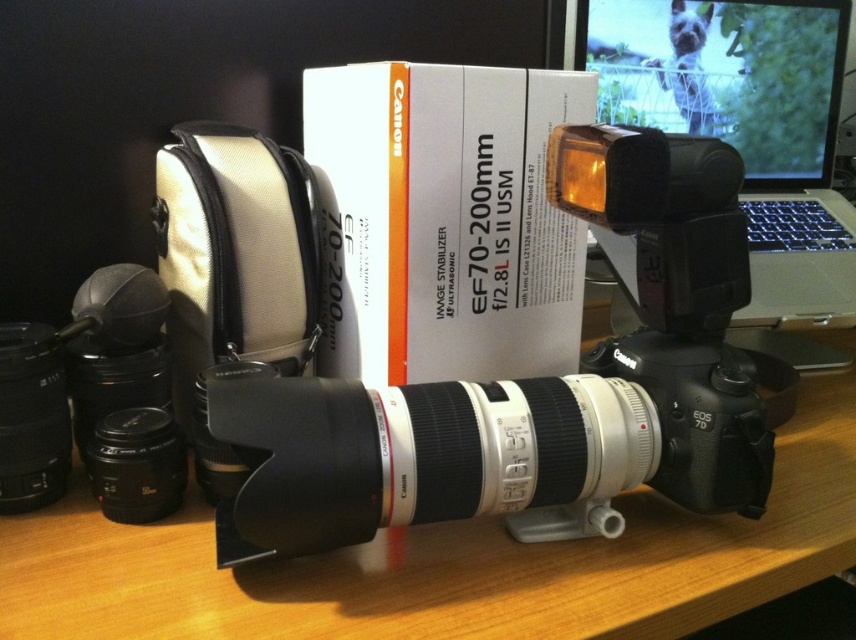
Is wooden table at center smaller than silver metallic laptop at upper right?

Actually, wooden table at center might be larger than silver metallic laptop at upper right.

Is wooden table at center below silver metallic laptop at upper right?

Correct, wooden table at center is located below silver metallic laptop at upper right.

Is point (394, 573) in front of point (764, 216)?

Yes, it is.

The image size is (856, 640). In order to click on wooden table at center in this screenshot , I will do `click(446, 563)`.

How distant is black plastic camera at center from silver metallic laptop at upper right?

33.86 centimeters

Does black plastic camera at center appear on the left side of silver metallic laptop at upper right?

Indeed, black plastic camera at center is positioned on the left side of silver metallic laptop at upper right.

Is point (551, 451) farther from viewer compared to point (827, 198)?

No, it is in front of (827, 198).

I want to click on black plastic camera at center, so click(532, 388).

Is black plastic camera at center to the right of wooden table at center from the viewer's perspective?

In fact, black plastic camera at center is to the left of wooden table at center.

Can you confirm if black plastic camera at center is bigger than wooden table at center?

No.

Is point (727, 145) farther from camera compared to point (162, 529)?

No, it is not.

Where is `black plastic camera at center`? This screenshot has height=640, width=856. black plastic camera at center is located at coordinates (532, 388).